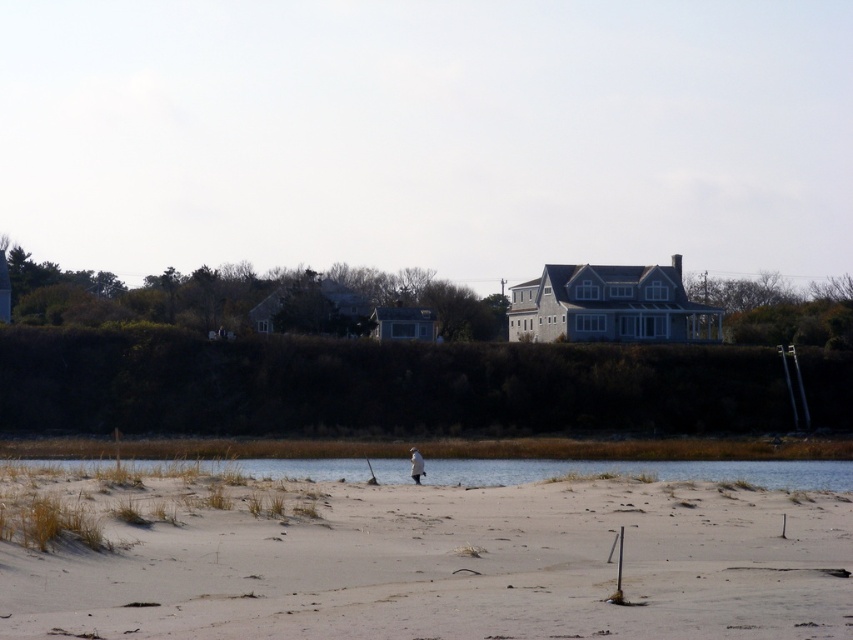
Question: Which point appears farthest from the camera in this image?

Choices:
 (A) (44, 468)
 (B) (405, 508)

Answer: (A)

Question: Which point is closer to the camera?

Choices:
 (A) white sandy beach at lower left
 (B) clear water at lower center

Answer: (A)

Question: Does white sandy beach at lower left come in front of clear water at lower center?

Choices:
 (A) no
 (B) yes

Answer: (B)

Question: Does white sandy beach at lower left appear under clear water at lower center?

Choices:
 (A) no
 (B) yes

Answer: (A)

Question: Observing the image, what is the correct spatial positioning of white sandy beach at lower left in reference to clear water at lower center?

Choices:
 (A) above
 (B) below

Answer: (A)